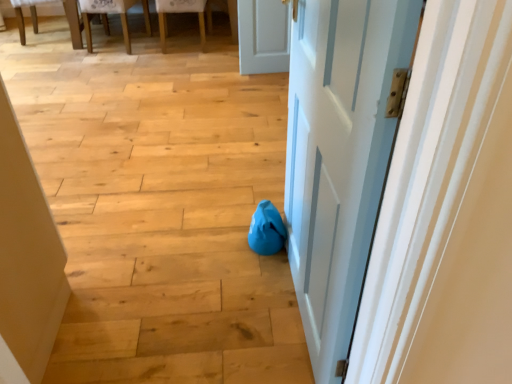
Describe the element at coordinates (182, 12) in the screenshot. I see `wooden chair at upper left, the 1th chair from the right` at that location.

Image resolution: width=512 pixels, height=384 pixels. Find the location of `blue fabric bean bag at center`. blue fabric bean bag at center is located at coordinates (266, 230).

Image resolution: width=512 pixels, height=384 pixels. Identify the location of wooden textured chair at upper left, the 2th chair viewed from the right. (106, 17).

From the image's perspective, is wooden textured chair at upper left, which is the first chair from left to right, below white painted wood door at center?

Actually, wooden textured chair at upper left, which is the first chair from left to right, appears above white painted wood door at center in the image.

Is wooden textured chair at upper left, which is the first chair from left to right, taller than white painted wood door at center?

No.

Looking at the image, does wooden textured chair at upper left, which is the first chair from left to right, seem bigger or smaller compared to white painted wood door at center?

wooden textured chair at upper left, which is the first chair from left to right, is bigger than white painted wood door at center.

Would you say wooden textured chair at upper left, which is the first chair from left to right, is inside or outside white painted wood door at center?

wooden textured chair at upper left, which is the first chair from left to right, is located beyond the bounds of white painted wood door at center.

Which of these two, blue fabric bean bag at center or white painted wood door at center, is smaller?

With smaller size is blue fabric bean bag at center.

Between blue fabric bean bag at center and white painted wood door at center, which one appears on the right side from the viewer's perspective?

white painted wood door at center.

The height and width of the screenshot is (384, 512). I want to click on door on the right side of blue fabric bean bag at center, so pyautogui.click(x=339, y=157).

Considering the relative sizes of wooden chair at upper left, which ranks as the 2th chair in left-to-right order, and wooden textured chair at upper left, the 2th chair viewed from the right, in the image provided, is wooden chair at upper left, which ranks as the 2th chair in left-to-right order, taller than wooden textured chair at upper left, the 2th chair viewed from the right,?

Correct, wooden chair at upper left, which ranks as the 2th chair in left-to-right order, is much taller as wooden textured chair at upper left, the 2th chair viewed from the right.

Is wooden chair at upper left, the 1th chair from the right, wider or thinner than wooden textured chair at upper left, which is the first chair from left to right?

In the image, wooden chair at upper left, the 1th chair from the right, appears to be more narrow than wooden textured chair at upper left, which is the first chair from left to right.

Can wooden textured chair at upper left, which is the first chair from left to right, be found inside wooden chair at upper left, which ranks as the 2th chair in left-to-right order?

Definitely not — wooden textured chair at upper left, which is the first chair from left to right, is not inside wooden chair at upper left, which ranks as the 2th chair in left-to-right order.

Where is `chair behind the wooden textured chair at upper left, the 2th chair viewed from the right`? The image size is (512, 384). chair behind the wooden textured chair at upper left, the 2th chair viewed from the right is located at coordinates (182, 12).

Is white painted wood door at center outside of wooden chair at upper left, which ranks as the 2th chair in left-to-right order?

Absolutely, white painted wood door at center is external to wooden chair at upper left, which ranks as the 2th chair in left-to-right order.

Which object is wider, white painted wood door at center or wooden chair at upper left, the 1th chair from the right?

With larger width is wooden chair at upper left, the 1th chair from the right.

Is white painted wood door at center oriented towards wooden chair at upper left, which ranks as the 2th chair in left-to-right order?

No, white painted wood door at center is not aimed at wooden chair at upper left, which ranks as the 2th chair in left-to-right order.

From the image's perspective, is white painted wood door at center below wooden chair at upper left, the 1th chair from the right?

Yes, from the image's perspective, white painted wood door at center is beneath wooden chair at upper left, the 1th chair from the right.

Is wooden chair at upper left, which ranks as the 2th chair in left-to-right order, completely or partially outside of white painted wood door at center?

Yes, wooden chair at upper left, which ranks as the 2th chair in left-to-right order, is outside of white painted wood door at center.

Who is shorter, wooden chair at upper left, which ranks as the 2th chair in left-to-right order, or white painted wood door at center?

Standing shorter between the two is wooden chair at upper left, which ranks as the 2th chair in left-to-right order.

I want to click on the 2nd chair positioned below the white painted wood door at center (from a real-world perspective), so click(x=182, y=12).

Is point (160, 11) positioned in front of point (313, 266)?

No, (160, 11) is behind (313, 266).

Consider the image. Is wooden textured chair at upper left, the 2th chair viewed from the right, oriented away from blue fabric bean bag at center?

No, blue fabric bean bag at center is not at the back of wooden textured chair at upper left, the 2th chair viewed from the right.

Is wooden textured chair at upper left, which is the first chair from left to right, in front of or behind blue fabric bean bag at center in the image?

wooden textured chair at upper left, which is the first chair from left to right, is positioned farther from the viewer than blue fabric bean bag at center.

Would you say wooden textured chair at upper left, the 2th chair viewed from the right, is to the left or to the right of blue fabric bean bag at center in the picture?

From the image, it's evident that wooden textured chair at upper left, the 2th chair viewed from the right, is to the left of blue fabric bean bag at center.

Is wooden textured chair at upper left, the 2th chair viewed from the right, in contact with blue fabric bean bag at center?

No, wooden textured chair at upper left, the 2th chair viewed from the right, is not in contact with blue fabric bean bag at center.

Considering the relative sizes of white painted wood door at center and blue fabric bean bag at center in the image provided, is white painted wood door at center smaller than blue fabric bean bag at center?

Actually, white painted wood door at center might be larger than blue fabric bean bag at center.

Looking at this image, is blue fabric bean bag at center at the back of white painted wood door at center?

No, white painted wood door at center's orientation is not away from blue fabric bean bag at center.

From the image's perspective, is white painted wood door at center beneath blue fabric bean bag at center?

No, from the image's perspective, white painted wood door at center is not beneath blue fabric bean bag at center.

From a real-world perspective, count 1st chairs downward from the white painted wood door at center and point to it. Please provide its 2D coordinates.

[(106, 17)]

Where is `door on the right of the blue fabric bean bag at center`? The width and height of the screenshot is (512, 384). door on the right of the blue fabric bean bag at center is located at coordinates (339, 157).

When comparing their distances from wooden textured chair at upper left, which is the first chair from left to right, does blue fabric bean bag at center or wooden chair at upper left, which ranks as the 2th chair in left-to-right order, seem closer?

wooden chair at upper left, which ranks as the 2th chair in left-to-right order, is positioned closer to the anchor wooden textured chair at upper left, which is the first chair from left to right.

Estimate the real-world distances between objects in this image. Which object is closer to white painted wood door at center, wooden chair at upper left, the 1th chair from the right, or blue fabric bean bag at center?

Among the two, blue fabric bean bag at center is located nearer to white painted wood door at center.

Based on their spatial positions, is blue fabric bean bag at center or white painted wood door at center further from wooden textured chair at upper left, the 2th chair viewed from the right?

Among the two, white painted wood door at center is located further to wooden textured chair at upper left, the 2th chair viewed from the right.

Which object lies further to the anchor point blue fabric bean bag at center, white painted wood door at center or wooden textured chair at upper left, the 2th chair viewed from the right?

The object further to blue fabric bean bag at center is wooden textured chair at upper left, the 2th chair viewed from the right.

From the image, which object appears to be nearer to wooden textured chair at upper left, the 2th chair viewed from the right, white painted wood door at center or blue fabric bean bag at center?

blue fabric bean bag at center is closer to wooden textured chair at upper left, the 2th chair viewed from the right.

Estimate the real-world distances between objects in this image. Which object is closer to white painted wood door at center, wooden textured chair at upper left, which is the first chair from left to right, or blue fabric bean bag at center?

Based on the image, blue fabric bean bag at center appears to be nearer to white painted wood door at center.

Looking at this image, which object lies nearer to the anchor point wooden chair at upper left, the 1th chair from the right, wooden textured chair at upper left, which is the first chair from left to right, or blue fabric bean bag at center?

wooden textured chair at upper left, which is the first chair from left to right, is positioned closer to the anchor wooden chair at upper left, the 1th chair from the right.

From the image, which object appears to be nearer to wooden chair at upper left, which ranks as the 2th chair in left-to-right order, white painted wood door at center or blue fabric bean bag at center?

blue fabric bean bag at center lies closer to wooden chair at upper left, which ranks as the 2th chair in left-to-right order, than the other object.

Where is `chair located between white painted wood door at center and wooden chair at upper left, which ranks as the 2th chair in left-to-right order, in the depth direction`? chair located between white painted wood door at center and wooden chair at upper left, which ranks as the 2th chair in left-to-right order, in the depth direction is located at coordinates (106, 17).

Identify the location of chair between blue fabric bean bag at center and wooden chair at upper left, which ranks as the 2th chair in left-to-right order, in the front-back direction. (106, 17).

Locate an element on the screen. bean bag chair positioned between white painted wood door at center and wooden textured chair at upper left, the 2th chair viewed from the right, from near to far is located at coordinates (266, 230).

Where is `bean bag chair positioned between white painted wood door at center and wooden chair at upper left, which ranks as the 2th chair in left-to-right order, from near to far`? The width and height of the screenshot is (512, 384). bean bag chair positioned between white painted wood door at center and wooden chair at upper left, which ranks as the 2th chair in left-to-right order, from near to far is located at coordinates (266, 230).